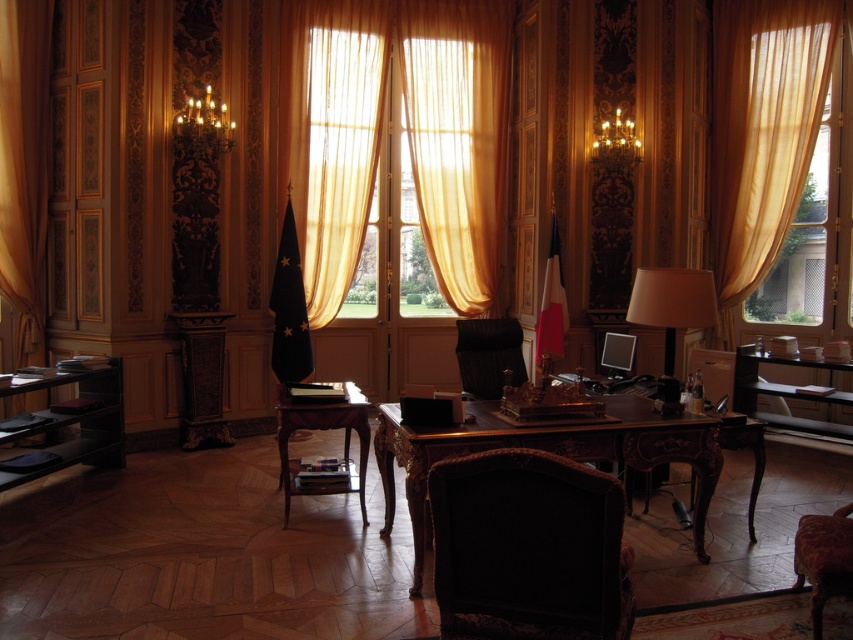
Does mahogany wood desk at center have a lesser width compared to wooden polished table at center?

Incorrect, mahogany wood desk at center's width is not less than wooden polished table at center's.

In the scene shown: Is mahogany wood desk at center above wooden polished table at center?

Yes.

The width and height of the screenshot is (853, 640). Describe the element at coordinates (546, 451) in the screenshot. I see `mahogany wood desk at center` at that location.

Identify the location of mahogany wood desk at center. (546, 451).

Can you confirm if translucent gold curtain at center is positioned to the right of mahogany wood desk at center?

No, translucent gold curtain at center is not to the right of mahogany wood desk at center.

Which is in front, point (286, 72) or point (502, 428)?

Point (502, 428) is more forward.

Is point (480, 211) in front of point (653, 465)?

No, it is not.

The width and height of the screenshot is (853, 640). I want to click on translucent gold curtain at center, so click(408, 134).

Between point (283, 54) and point (74, 397), which one is positioned behind?

The point (283, 54) is behind.

Is point (289, 116) closer to viewer compared to point (62, 429)?

No.

At what (x,y) coordinates should I click in order to perform the action: click on translucent gold curtain at center. Please return your answer as a coordinate pair (x, y). This screenshot has height=640, width=853. Looking at the image, I should click on (408, 134).